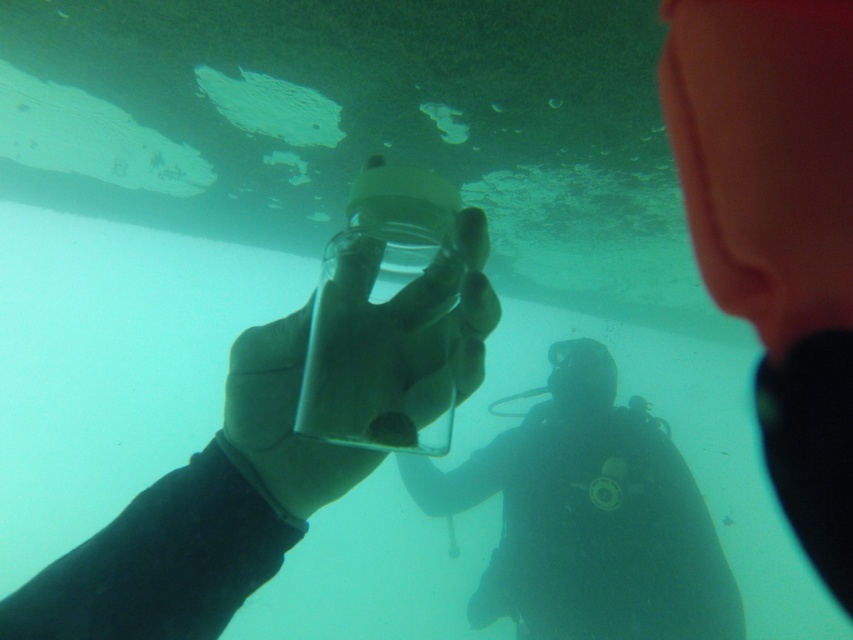
You are a marine biologist observing an underwater scene. You notice the black scuba suit at center and the transparent glass jar at center. Based on their positions, which object is closer to the surface of the water?

The transparent glass jar at center is closer to the surface of the water because the black scuba suit at center is located below it.